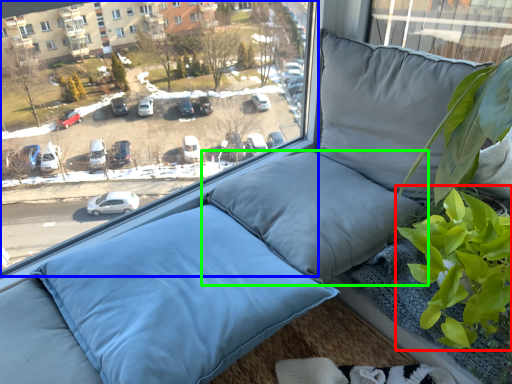
Question: Which object is positioned closest to vegetation (highlighted by a red box)? Select from window (highlighted by a blue box) and pillow (highlighted by a green box).

Choices:
 (A) window
 (B) pillow

Answer: (B)